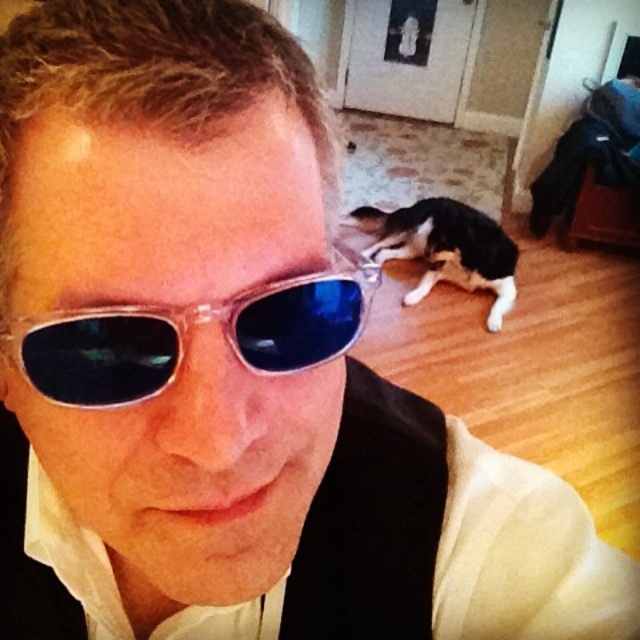
Who is positioned more to the left, transparent plastic sunglasses at center or black and white fur at lower center?

Positioned to the left is transparent plastic sunglasses at center.

Looking at this image, is transparent plastic sunglasses at center behind black and white fur at lower center?

No, it is not.

What do you see at coordinates (186, 332) in the screenshot? I see `transparent plastic sunglasses at center` at bounding box center [186, 332].

This screenshot has width=640, height=640. What are the coordinates of `transparent plastic sunglasses at center` in the screenshot? It's located at pyautogui.click(x=186, y=332).